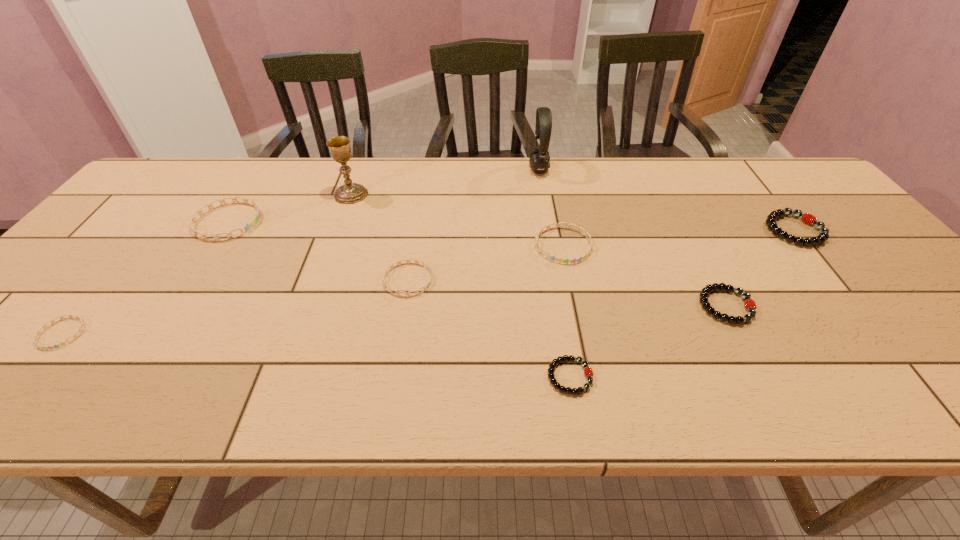
Find the location of a particular element. The image size is (960, 540). unoccupied area between the headset and the nearest black bracelet is located at coordinates click(x=554, y=273).

You are a GUI agent. You are given a task and a screenshot of the screen. Output one action in this format:
    pyautogui.click(x=<x>, y=<y>)
    Task: Click on the free space between the farthest black bracelet and the nearest bracelet
    
    Given the screenshot: What is the action you would take?
    pyautogui.click(x=682, y=303)

Where is `blank region between the second bracelet from right to left and the headset`? Image resolution: width=960 pixels, height=540 pixels. blank region between the second bracelet from right to left and the headset is located at coordinates (633, 238).

This screenshot has height=540, width=960. Identify the location of vacant space that is in between the leftmost bracelet and the second smallest blue bracelet. (235, 306).

Identify which object is the fifth nearest to the biggest blue bracelet. Please provide its 2D coordinates. Your answer should be formatted as a tuple, i.e. [(x, y)], where the tuple contains the x and y coordinates of a point satisfying the conditions above.

[(539, 158)]

Identify which object is the fifth closest to the nearest black bracelet. Please provide its 2D coordinates. Your answer should be formatted as a tuple, i.e. [(x, y)], where the tuple contains the x and y coordinates of a point satisfying the conditions above.

[(539, 158)]

In order to click on bracelet that is the fifth closest to the nearest object in this screenshot , I will do `click(247, 227)`.

Where is `bracelet object that ranks as the fourth closest to the third blue bracelet from right to left`? bracelet object that ranks as the fourth closest to the third blue bracelet from right to left is located at coordinates (588, 372).

Select which blue bracelet is the second closest to the shortest object. Please provide its 2D coordinates. Your answer should be formatted as a tuple, i.e. [(x, y)], where the tuple contains the x and y coordinates of a point satisfying the conditions above.

[(417, 261)]

This screenshot has width=960, height=540. What are the coordinates of `the third closest blue bracelet to the third blue bracelet from right to left` in the screenshot? It's located at [x=585, y=233].